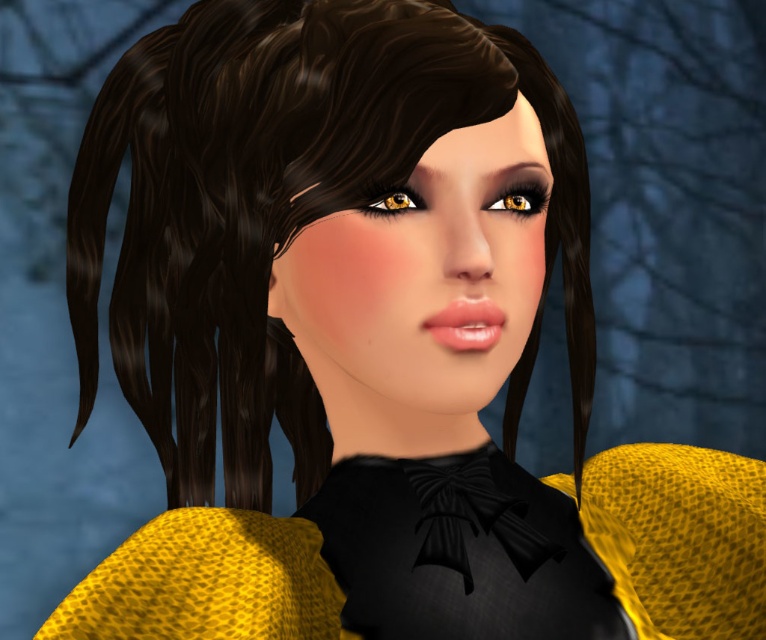
Is yellow mesh dress at center smaller than golden matte eye at center?

Actually, yellow mesh dress at center might be larger than golden matte eye at center.

Is yellow mesh dress at center above golden matte eye at center?

Actually, yellow mesh dress at center is below golden matte eye at center.

This screenshot has height=640, width=766. Identify the location of yellow mesh dress at center. pyautogui.click(x=679, y=538).

Can you confirm if yellow mesh dress at center is thinner than matte yellow eye at upper center?

Incorrect, yellow mesh dress at center's width is not less than matte yellow eye at upper center's.

Who is more forward, (x=761, y=552) or (x=388, y=209)?

Positioned in front is point (x=388, y=209).

At what (x,y) coordinates should I click in order to perform the action: click on yellow mesh dress at center. Please return your answer as a coordinate pair (x, y). The width and height of the screenshot is (766, 640). Looking at the image, I should click on (679, 538).

Between golden matte eye at center and matte yellow eye at upper center, which one is positioned higher?

Positioned higher is golden matte eye at center.

Between golden matte eye at center and matte yellow eye at upper center, which one has less height?

With less height is matte yellow eye at upper center.

Who is more forward, (496, 205) or (388, 195)?

Positioned in front is point (388, 195).

Locate an element on the screen. Image resolution: width=766 pixels, height=640 pixels. golden matte eye at center is located at coordinates tap(521, 196).